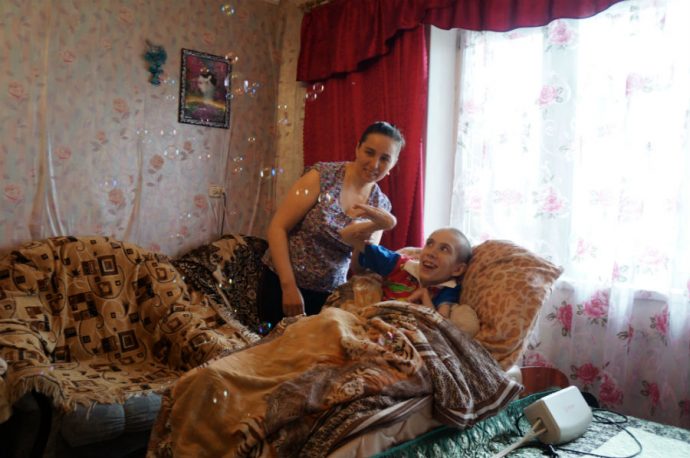
Identify the location of blanket. The height and width of the screenshot is (458, 690). (128, 362), (246, 261), (268, 359), (495, 299).